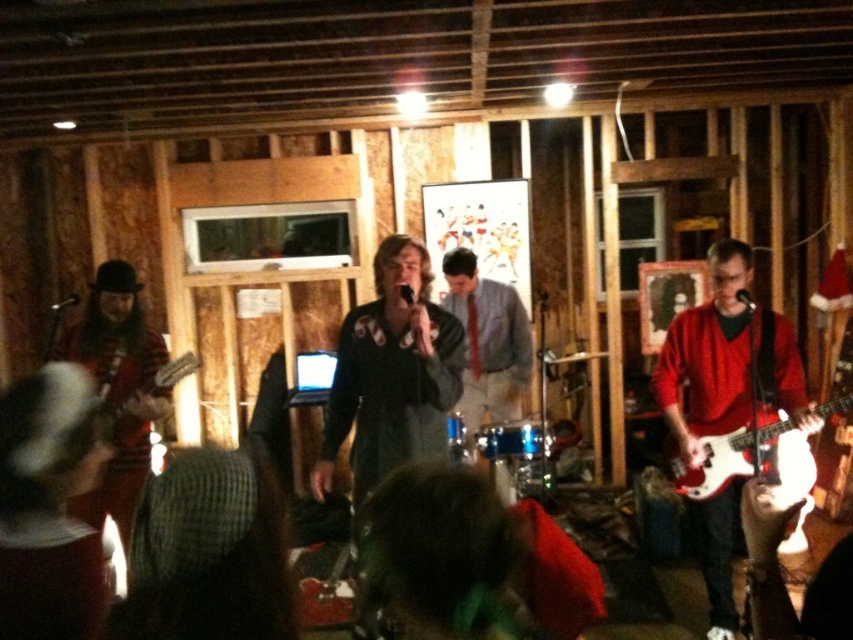
Question: Does glossy red electric guitar at right appear under matte black electric guitar at left?

Choices:
 (A) yes
 (B) no

Answer: (A)

Question: Which point appears closest to the camera in this image?

Choices:
 (A) (804, 460)
 (B) (107, 392)

Answer: (B)

Question: Which point appears farthest from the camera in this image?

Choices:
 (A) click(109, 410)
 (B) click(512, 365)

Answer: (B)

Question: Which of these objects is positioned farthest from the red glossy electric guitar at right?

Choices:
 (A) glossy red electric guitar at right
 (B) matte black electric guitar at left

Answer: (B)

Question: Can you confirm if red glossy electric guitar at right is positioned below matte black electric guitar at left?

Choices:
 (A) yes
 (B) no

Answer: (A)

Question: Does blue fabric tie at center appear on the right side of matte black electric guitar at left?

Choices:
 (A) yes
 (B) no

Answer: (A)